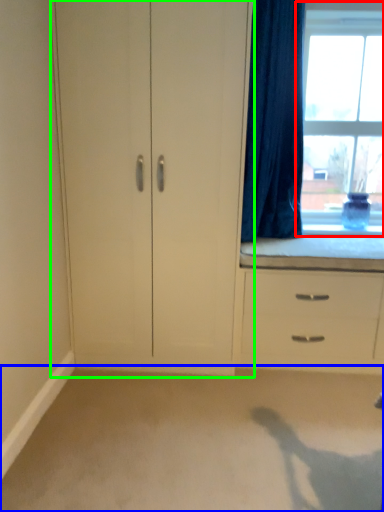
Question: Which is farther away from window (highlighted by a red box)? plain (highlighted by a blue box) or cupboard (highlighted by a green box)?

Choices:
 (A) plain
 (B) cupboard

Answer: (A)